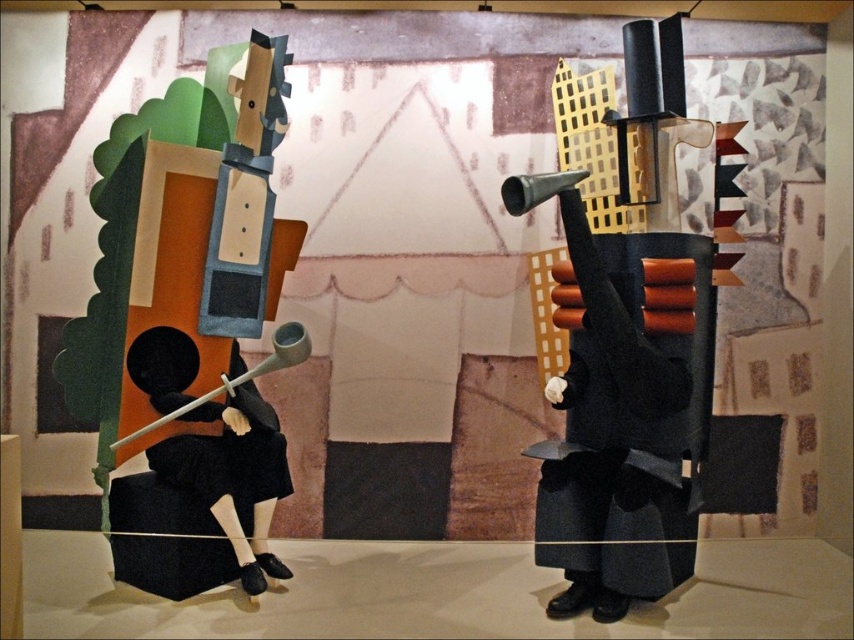
Question: Does matte black coat at right have a lesser width compared to black matte figure at left?

Choices:
 (A) no
 (B) yes

Answer: (A)

Question: Among these points, which one is farthest from the camera?

Choices:
 (A) (176, 518)
 (B) (154, 468)

Answer: (B)

Question: In this image, where is matte black coat at right located relative to black matte figure at left?

Choices:
 (A) right
 (B) left

Answer: (A)

Question: Which object is farther from the camera taking this photo?

Choices:
 (A) matte black violin at left
 (B) matte black coat at right

Answer: (A)

Question: Which of these objects is positioned closest to the matte black coat at right?

Choices:
 (A) black matte figure at left
 (B) matte black violin at left

Answer: (A)

Question: Where is matte black violin at left located in relation to black matte figure at left in the image?

Choices:
 (A) above
 (B) below

Answer: (A)